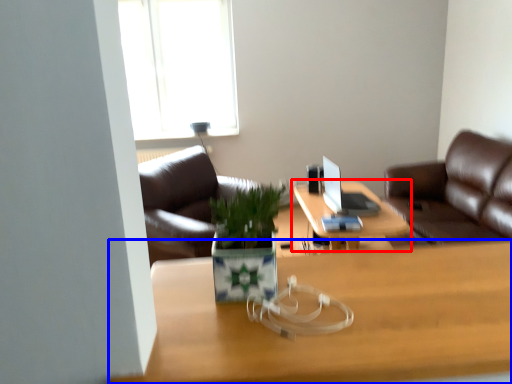
Question: Among these objects, which one is farthest to the camera, table (highlighted by a red box) or desk (highlighted by a blue box)?

Choices:
 (A) table
 (B) desk

Answer: (A)